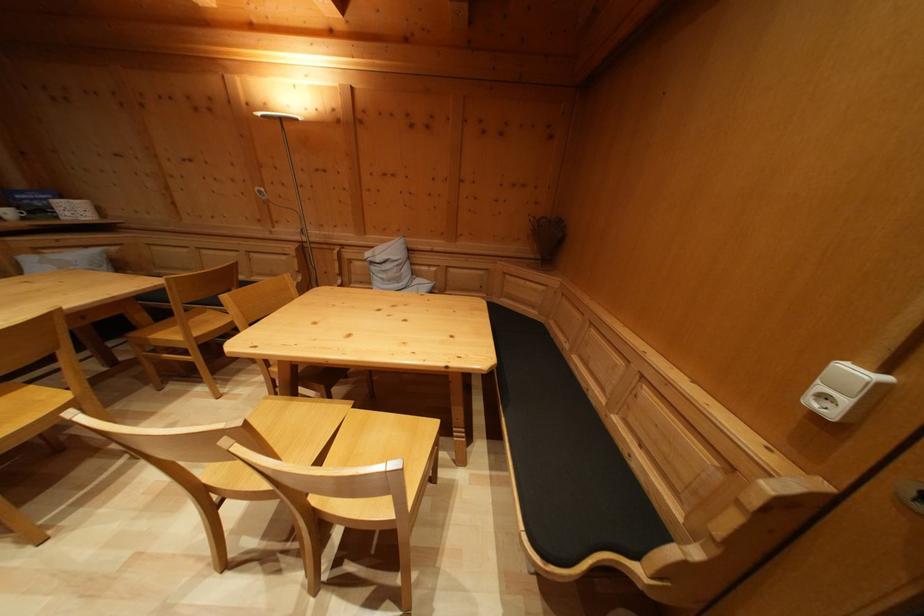
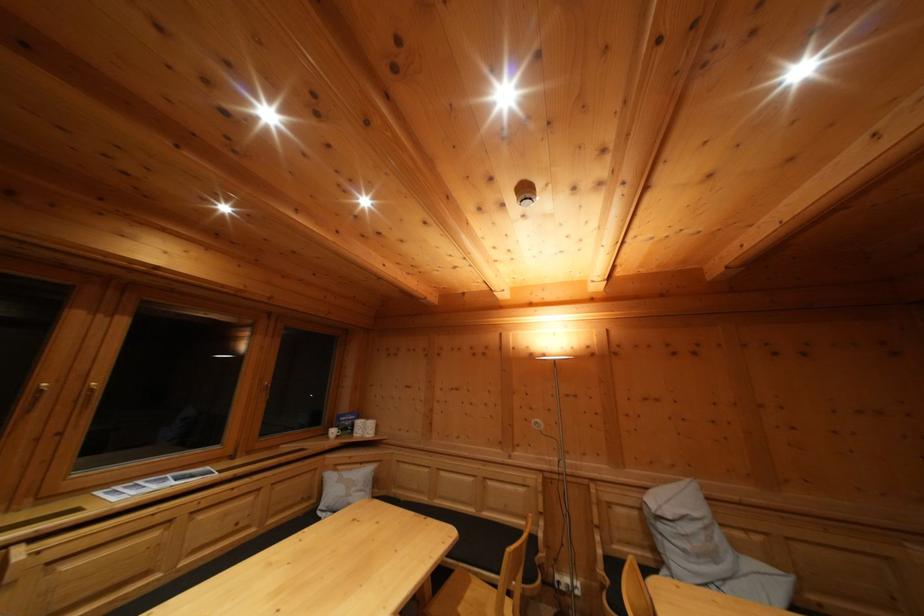
In the second image, find the point that corresponds to [92,254] in the first image.

(368, 469)